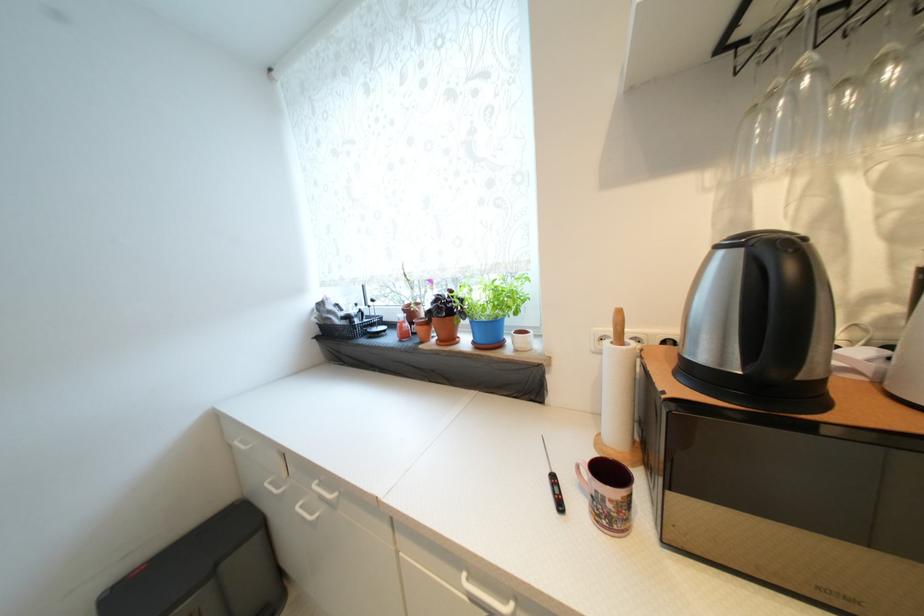
The width and height of the screenshot is (924, 616). In order to click on white ceramic cup in this screenshot , I will do `click(610, 495)`.